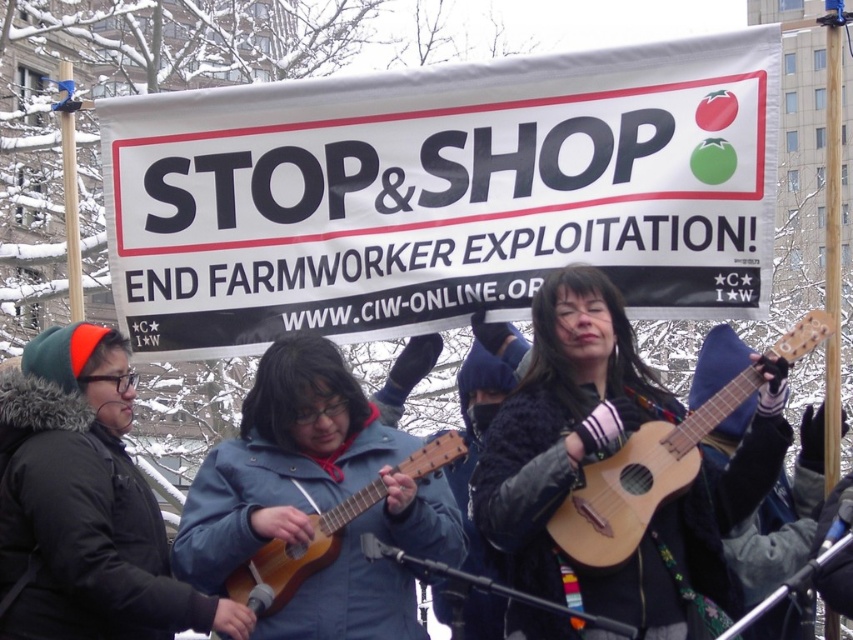
Question: Which object is positioned closest to the wooden acoustic guitar at center?

Choices:
 (A) dark green fur-lined jacket at left
 (B) light brown wooden guitar at center

Answer: (A)

Question: Is dark green fur-lined jacket at left to the right of light brown wooden guitar at center from the viewer's perspective?

Choices:
 (A) no
 (B) yes

Answer: (A)

Question: Is light brown wooden guitar at center above wooden acoustic guitar at center?

Choices:
 (A) yes
 (B) no

Answer: (A)

Question: Is the position of light brown wooden guitar at center less distant than that of wooden acoustic guitar at center?

Choices:
 (A) no
 (B) yes

Answer: (B)

Question: Which point is closer to the camera?

Choices:
 (A) light brown wooden guitar at center
 (B) wooden acoustic guitar at center
 (C) dark green fur-lined jacket at left

Answer: (C)

Question: Which is nearer to the dark green fur-lined jacket at left?

Choices:
 (A) light brown wooden guitar at center
 (B) wooden acoustic guitar at center

Answer: (B)